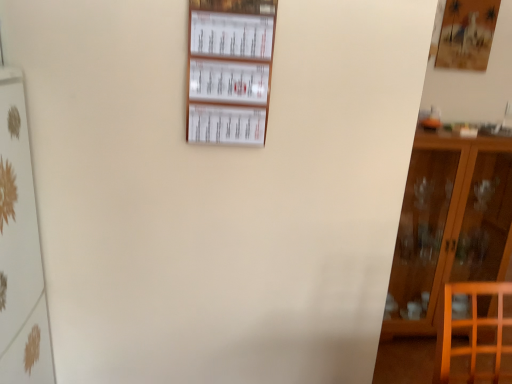
What do you see at coordinates (20, 248) in the screenshot? I see `white glossy shelf at left, which is the second shelf in top-to-bottom order` at bounding box center [20, 248].

At what (x,y) coordinates should I click in order to perform the action: click on brown wooden cabinet at right. Please return your answer as a coordinate pair (x, y). Image resolution: width=512 pixels, height=384 pixels. Looking at the image, I should click on (449, 223).

Visually, is white glossy shelf at left, which is the second shelf in top-to-bottom order, positioned to the left or to the right of brown wooden cabinet at right?

Clearly, white glossy shelf at left, which is the second shelf in top-to-bottom order, is on the left of brown wooden cabinet at right in the image.

In the scene shown: Is white glossy shelf at left, which is counted as the first shelf, starting from the left, not near brown wooden cabinet at right?

Indeed, white glossy shelf at left, which is counted as the first shelf, starting from the left, is not near brown wooden cabinet at right.

Considering the sizes of objects white glossy shelf at left, which is the second shelf in top-to-bottom order, and brown wooden cabinet at right in the image provided, who is bigger, white glossy shelf at left, which is the second shelf in top-to-bottom order, or brown wooden cabinet at right?

With larger size is brown wooden cabinet at right.

Is white glossy shelf at left, placed as the 2th shelf when sorted from right to left, not within brown wooden cabinet at right?

Yes, white glossy shelf at left, placed as the 2th shelf when sorted from right to left, is outside of brown wooden cabinet at right.

Is point (33, 332) in front of point (230, 81)?

No, it is not.

Is white glossy shelf at left, placed as the 2th shelf when sorted from right to left, in front of or behind white paperboard at upper center, positioned as the 1th shelf in right-to-left order, in the image?

Visually, white glossy shelf at left, placed as the 2th shelf when sorted from right to left, is located in front of white paperboard at upper center, positioned as the 1th shelf in right-to-left order.

Who is bigger, white glossy shelf at left, which is the second shelf in top-to-bottom order, or white paperboard at upper center, which is the 1th shelf from top to bottom?

Bigger between the two is white glossy shelf at left, which is the second shelf in top-to-bottom order.

Would you consider white glossy shelf at left, placed as the 2th shelf when sorted from right to left, to be distant from white paperboard at upper center, which is the 1th shelf from top to bottom?

No, white glossy shelf at left, placed as the 2th shelf when sorted from right to left, is not far from white paperboard at upper center, which is the 1th shelf from top to bottom.

Is white paperboard at upper center, the 2th shelf from the left, wider or thinner than brown wooden cabinet at right?

In the image, white paperboard at upper center, the 2th shelf from the left, appears to be more narrow than brown wooden cabinet at right.

Is white paperboard at upper center, positioned as the 1th shelf in right-to-left order, oriented towards brown wooden cabinet at right?

No, white paperboard at upper center, positioned as the 1th shelf in right-to-left order, is not facing towards brown wooden cabinet at right.

From the picture: From a real-world perspective, which is physically above, white paperboard at upper center, which is the 1th shelf from top to bottom, or brown wooden cabinet at right?

white paperboard at upper center, which is the 1th shelf from top to bottom.

Can you confirm if white paperboard at upper center, the 2th shelf from the left, is bigger than white glossy shelf at left, which is counted as the first shelf, starting from the left?

No.

Is white paperboard at upper center, positioned as the 1th shelf in right-to-left order, beside white glossy shelf at left, placed as the 2th shelf when sorted from right to left?

No, white paperboard at upper center, positioned as the 1th shelf in right-to-left order, is not beside white glossy shelf at left, placed as the 2th shelf when sorted from right to left.

Based on the photo, is white paperboard at upper center, positioned as the 1th shelf in right-to-left order, shorter than white glossy shelf at left, which is the second shelf in top-to-bottom order?

Correct, white paperboard at upper center, positioned as the 1th shelf in right-to-left order, is not as tall as white glossy shelf at left, which is the second shelf in top-to-bottom order.

From the image's perspective, does white paperboard at upper center, positioned as the 2th shelf in bottom-to-top order, appear lower than white glossy shelf at left, placed as the 2th shelf when sorted from right to left?

Incorrect, from the image's perspective, white paperboard at upper center, positioned as the 2th shelf in bottom-to-top order, is higher than white glossy shelf at left, placed as the 2th shelf when sorted from right to left.

Could you tell me if brown wooden cabinet at right is facing white paperboard at upper center, the 2th shelf from the left?

No, brown wooden cabinet at right is not aimed at white paperboard at upper center, the 2th shelf from the left.

From a real-world perspective, which is physically above, brown wooden cabinet at right or white paperboard at upper center, the 2th shelf from the left?

white paperboard at upper center, the 2th shelf from the left.

Based on the photo, from the image's perspective, is brown wooden cabinet at right above or below white paperboard at upper center, positioned as the 1th shelf in right-to-left order?

brown wooden cabinet at right is situated lower than white paperboard at upper center, positioned as the 1th shelf in right-to-left order, in the image.

Which object is wider, brown wooden cabinet at right or white paperboard at upper center, positioned as the 1th shelf in right-to-left order?

Wider between the two is brown wooden cabinet at right.

From a real-world perspective, is brown wooden cabinet at right physically above white glossy shelf at left, placed as the 2th shelf when sorted from right to left?

Incorrect, from a real-world perspective, brown wooden cabinet at right is lower than white glossy shelf at left, placed as the 2th shelf when sorted from right to left.

Is brown wooden cabinet at right spatially inside white glossy shelf at left, which is the second shelf in top-to-bottom order, or outside of it?

brown wooden cabinet at right exists outside the volume of white glossy shelf at left, which is the second shelf in top-to-bottom order.

Is brown wooden cabinet at right touching white glossy shelf at left, which is the second shelf in top-to-bottom order?

brown wooden cabinet at right and white glossy shelf at left, which is the second shelf in top-to-bottom order, are not in contact.

From the picture: Considering the relative positions of brown wooden cabinet at right and white glossy shelf at left, which is counted as the first shelf, starting from the left, in the image provided, is brown wooden cabinet at right behind white glossy shelf at left, which is counted as the first shelf, starting from the left,?

Yes, brown wooden cabinet at right is further from the viewer.

Where is `the 1st shelf located above the brown wooden cabinet at right (from a real-world perspective)`? The height and width of the screenshot is (384, 512). the 1st shelf located above the brown wooden cabinet at right (from a real-world perspective) is located at coordinates (20, 248).

Locate an element on the screen. The width and height of the screenshot is (512, 384). shelf above the white glossy shelf at left, placed as the 2th shelf when sorted from right to left (from the image's perspective) is located at coordinates (230, 70).

Which object lies nearer to the anchor point white paperboard at upper center, positioned as the 1th shelf in right-to-left order, white glossy shelf at left, placed as the 2th shelf when sorted from right to left, or brown wooden cabinet at right?

white glossy shelf at left, placed as the 2th shelf when sorted from right to left, is positioned closer to the anchor white paperboard at upper center, positioned as the 1th shelf in right-to-left order.

From the image, which object appears to be nearer to brown wooden cabinet at right, white glossy shelf at left, which is counted as the first shelf, starting from the left, or white paperboard at upper center, positioned as the 1th shelf in right-to-left order?

white paperboard at upper center, positioned as the 1th shelf in right-to-left order.

Looking at the image, which one is located further to white paperboard at upper center, the 2th shelf from the left, brown wooden cabinet at right or white glossy shelf at left, which is the first shelf from bottom to top?

brown wooden cabinet at right lies further to white paperboard at upper center, the 2th shelf from the left, than the other object.

Based on their spatial positions, is brown wooden cabinet at right or white paperboard at upper center, which is the 1th shelf from top to bottom, closer to white glossy shelf at left, which is counted as the first shelf, starting from the left?

white paperboard at upper center, which is the 1th shelf from top to bottom.

Looking at the image, which one is located further to brown wooden cabinet at right, white paperboard at upper center, positioned as the 2th shelf in bottom-to-top order, or white glossy shelf at left, which is counted as the first shelf, starting from the left?

Among the two, white glossy shelf at left, which is counted as the first shelf, starting from the left, is located further to brown wooden cabinet at right.

Based on their spatial positions, is white paperboard at upper center, which is the 1th shelf from top to bottom, or brown wooden cabinet at right further from white glossy shelf at left, which is the second shelf in top-to-bottom order?

brown wooden cabinet at right.

Identify the location of shelf between white glossy shelf at left, which is counted as the first shelf, starting from the left, and brown wooden cabinet at right. (230, 70).